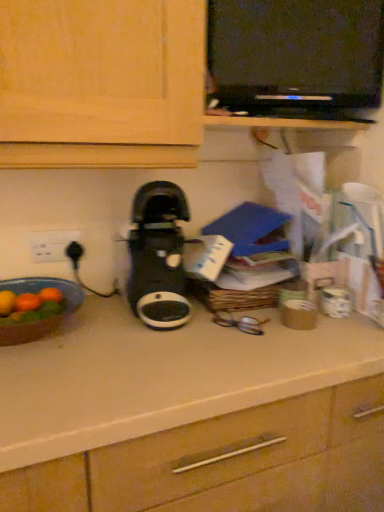
Question: Can you confirm if black plastic coffee maker at center is wider than matte brown bowl at left?

Choices:
 (A) yes
 (B) no

Answer: (A)

Question: Is black plastic coffee maker at center smaller than matte brown bowl at left?

Choices:
 (A) yes
 (B) no

Answer: (B)

Question: Is black plastic coffee maker at center closer to camera compared to matte brown bowl at left?

Choices:
 (A) yes
 (B) no

Answer: (B)

Question: Is black plastic coffee maker at center thinner than matte brown bowl at left?

Choices:
 (A) no
 (B) yes

Answer: (A)

Question: Is black plastic coffee maker at center facing towards matte brown bowl at left?

Choices:
 (A) no
 (B) yes

Answer: (A)

Question: Looking at the image, does white plastic electric outlet at left seem bigger or smaller compared to matte brown bowl at left?

Choices:
 (A) big
 (B) small

Answer: (B)

Question: In the image, is white plastic electric outlet at left positioned in front of or behind matte brown bowl at left?

Choices:
 (A) front
 (B) behind

Answer: (B)

Question: Considering the relative positions of white plastic electric outlet at left and matte brown bowl at left in the image provided, is white plastic electric outlet at left to the left or to the right of matte brown bowl at left?

Choices:
 (A) left
 (B) right

Answer: (A)

Question: From a real-world perspective, is white plastic electric outlet at left positioned above or below matte brown bowl at left?

Choices:
 (A) below
 (B) above

Answer: (B)

Question: Is black plastic coffee maker at center to the left or to the right of black plastic dvd player at upper center in the image?

Choices:
 (A) right
 (B) left

Answer: (B)

Question: Is point (144, 200) positioned closer to the camera than point (291, 67)?

Choices:
 (A) farther
 (B) closer

Answer: (B)

Question: In terms of width, does black plastic coffee maker at center look wider or thinner when compared to black plastic dvd player at upper center?

Choices:
 (A) thin
 (B) wide

Answer: (B)

Question: Considering their positions, is black plastic coffee maker at center located in front of or behind black plastic dvd player at upper center?

Choices:
 (A) behind
 (B) front

Answer: (B)

Question: Considering the positions of point (311, 77) and point (44, 246), is point (311, 77) closer or farther from the camera than point (44, 246)?

Choices:
 (A) closer
 (B) farther

Answer: (A)

Question: Is black plastic dvd player at upper center to the left or to the right of white plastic electric outlet at left in the image?

Choices:
 (A) left
 (B) right

Answer: (B)